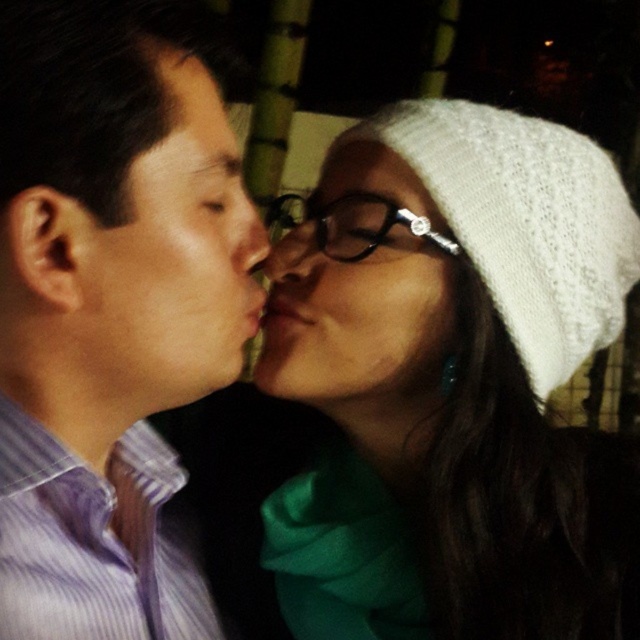
From the picture: Which is above, matte purple shirt at left or smooth skin nose at center?

Positioned higher is smooth skin nose at center.

Which is behind, point (179, 362) or point (237, 246)?

The point (237, 246) is behind.

Image resolution: width=640 pixels, height=640 pixels. Find the location of `matte purple shirt at left`. matte purple shirt at left is located at coordinates (173, 257).

Which is in front, point (141, 296) or point (300, 224)?

Point (141, 296) is more forward.

Is matte purple shirt at left to the left of matte black nose at center from the viewer's perspective?

Correct, you'll find matte purple shirt at left to the left of matte black nose at center.

The image size is (640, 640). What do you see at coordinates (173, 257) in the screenshot?
I see `matte purple shirt at left` at bounding box center [173, 257].

The image size is (640, 640). Identify the location of matte purple shirt at left. (173, 257).

From the picture: Who is positioned more to the left, white knitted hat at upper right or white knitted hat at center?

white knitted hat at center is more to the left.

Which is in front, point (502, 156) or point (339, 221)?

Point (502, 156)

Identify the location of white knitted hat at upper right. The height and width of the screenshot is (640, 640). (451, 381).